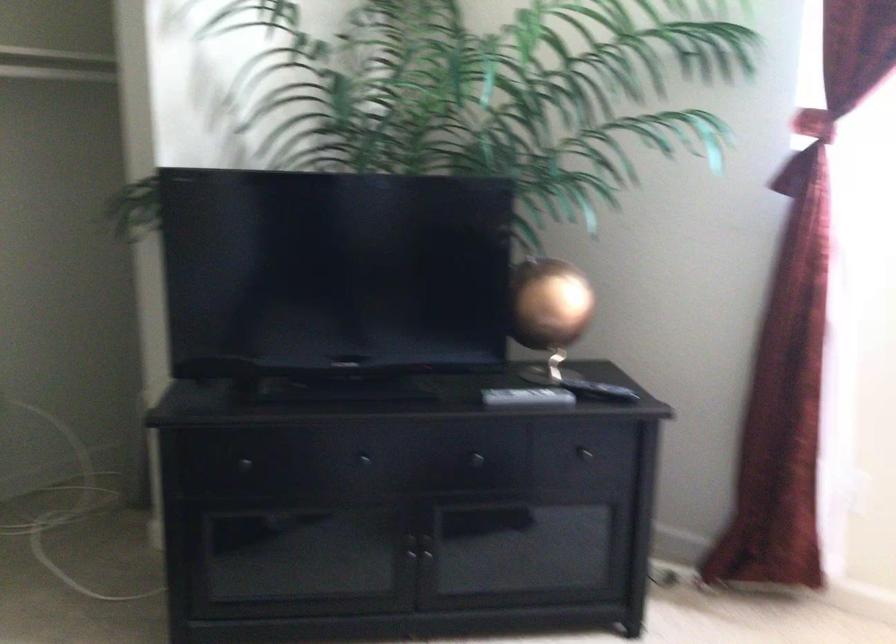
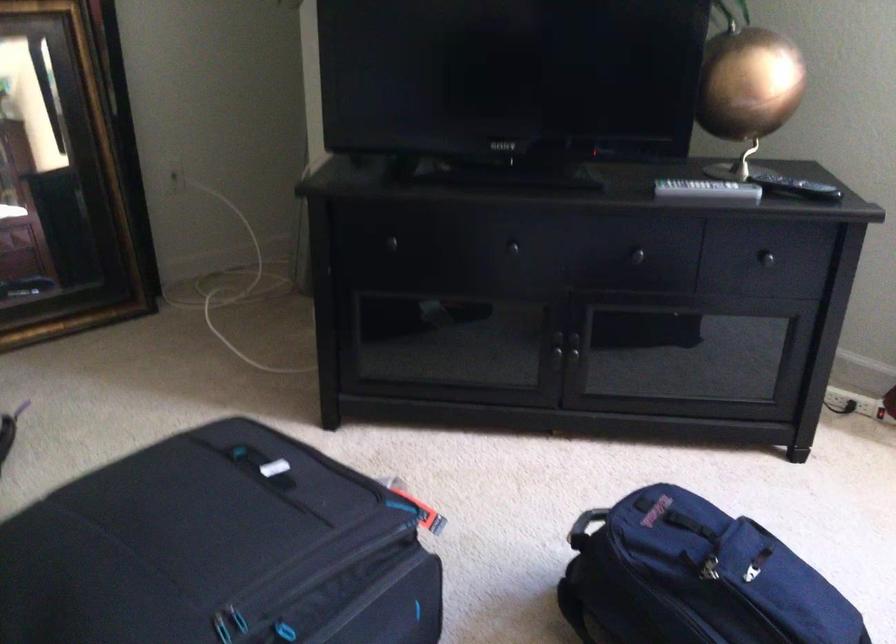
The point at (530, 395) is marked in the first image. Where is the corresponding point in the second image?

(707, 190)